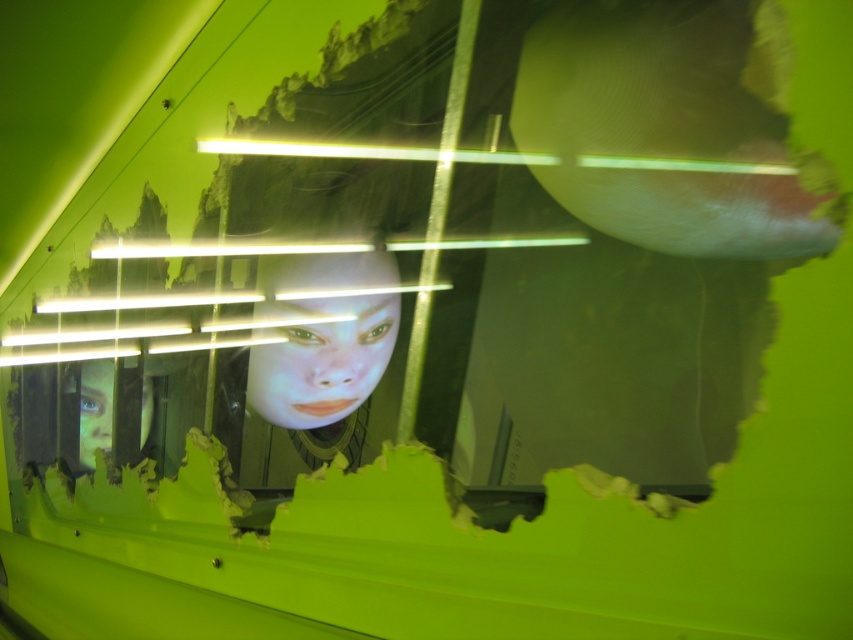
Where is `smooth skin face at center`? The image size is (853, 640). smooth skin face at center is located at coordinates (321, 356).

Where is `smooth skin face at center`? smooth skin face at center is located at coordinates [x=321, y=356].

The height and width of the screenshot is (640, 853). In order to click on smooth skin face at center in this screenshot , I will do `click(321, 356)`.